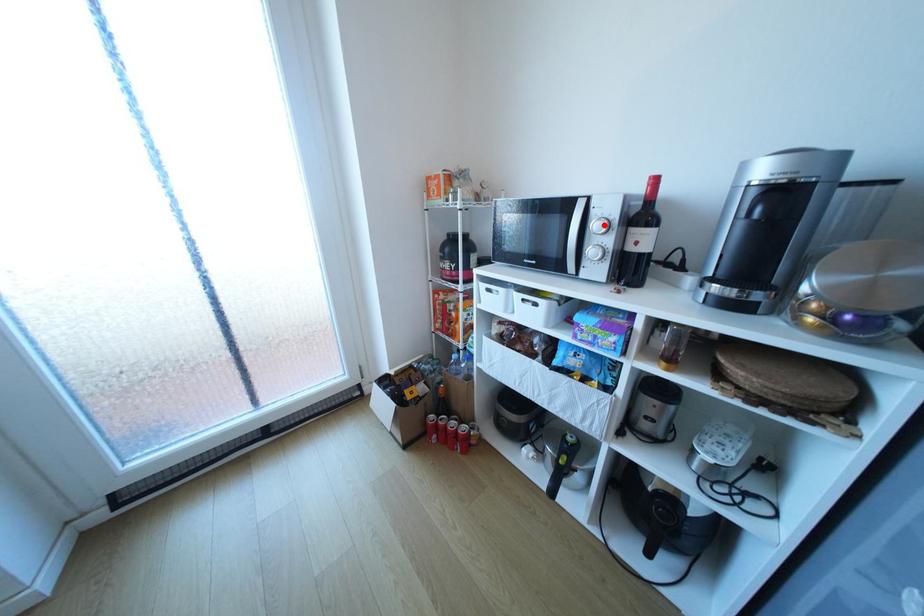
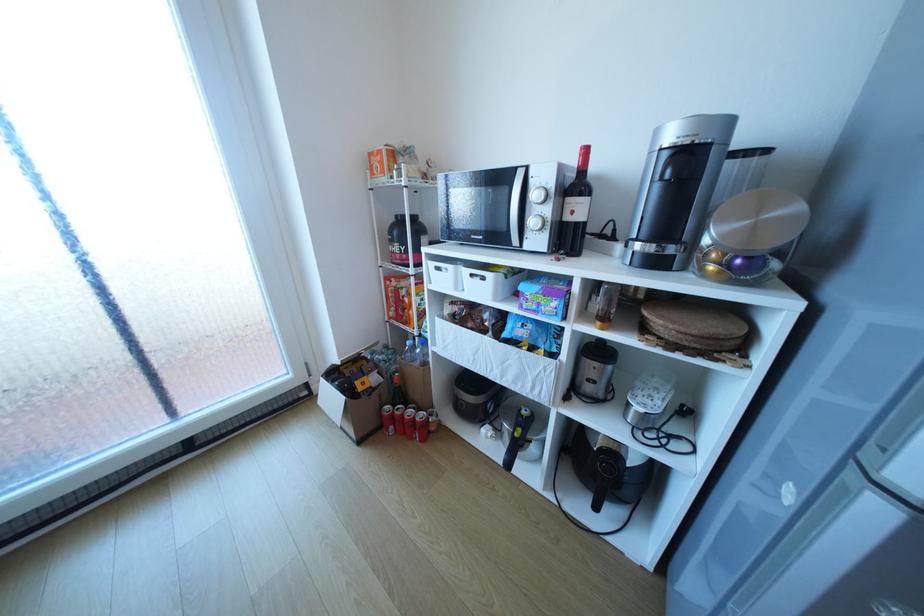
Locate, in the second image, the point that corresponds to the highlighted location in the first image.

(542, 195)